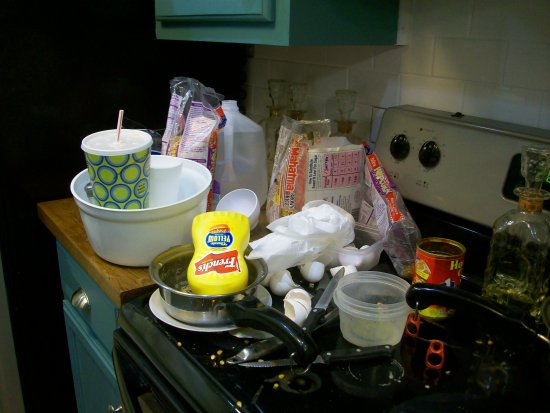
At what (x,y) coordinates should I click in order to perform the action: click on green cabinets. Please return your answer as a coordinate pair (x, y). The width and height of the screenshot is (550, 413). Looking at the image, I should click on (104, 319).